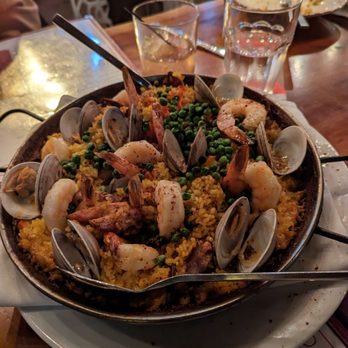
You are a GUI agent. You are given a task and a screenshot of the screen. Output one action in this format:
    pyautogui.click(x=<x>, y=<y>)
    Task: Click on the glass
    The image size is (348, 348).
    Given the screenshot: What is the action you would take?
    pyautogui.click(x=255, y=63), pyautogui.click(x=160, y=54)